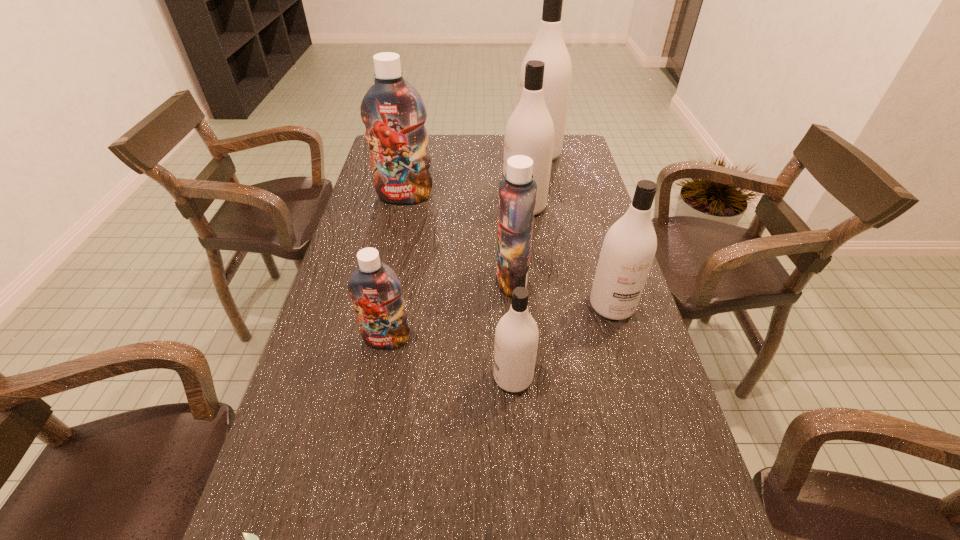
Find the location of `the smallest blue shampoo`. the smallest blue shampoo is located at coordinates (374, 287).

Where is `vacant space located on the front-facing side of the tallest object`? vacant space located on the front-facing side of the tallest object is located at coordinates (497, 154).

The height and width of the screenshot is (540, 960). What are the coordinates of `blank area located on the front-facing side of the tallest object` in the screenshot? It's located at (445, 154).

Locate an element on the screen. vacant area situated 0.390m on the front-facing side of the tallest object is located at coordinates (414, 154).

Identify the location of vacant point located 0.170m on the front-facing side of the third smallest white shampoo. Image resolution: width=960 pixels, height=540 pixels. (449, 206).

This screenshot has width=960, height=540. I want to click on vacant region located on the front-facing side of the third smallest white shampoo, so click(x=444, y=206).

At what (x,y) coordinates should I click in order to perform the action: click on blank space located on the front-facing side of the third smallest white shampoo. Please return your answer as a coordinate pair (x, y). The width and height of the screenshot is (960, 540). Looking at the image, I should click on (446, 206).

Locate an element on the screen. The width and height of the screenshot is (960, 540). vacant space located on the front label of the farthest blue shampoo is located at coordinates (394, 249).

Where is `vacant space located on the front label of the second biggest blue shampoo`? Image resolution: width=960 pixels, height=540 pixels. vacant space located on the front label of the second biggest blue shampoo is located at coordinates (349, 279).

Locate an element on the screen. This screenshot has height=540, width=960. free space located on the front label of the second biggest blue shampoo is located at coordinates point(448,279).